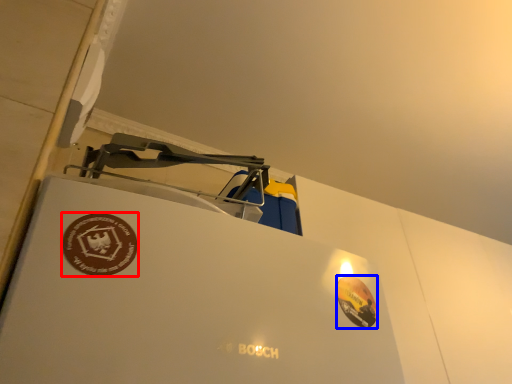
Question: Among these objects, which one is nearest to the camera, logo (highlighted by a red box) or logo (highlighted by a blue box)?

Choices:
 (A) logo
 (B) logo

Answer: (A)